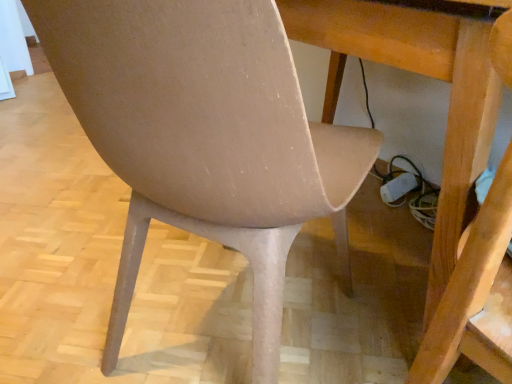
At what (x,y) coordinates should I click in order to perform the action: click on free location to the left of wooden table at center. Please return your answer as a coordinate pair (x, y). This screenshot has height=384, width=512. Looking at the image, I should click on point(66,210).